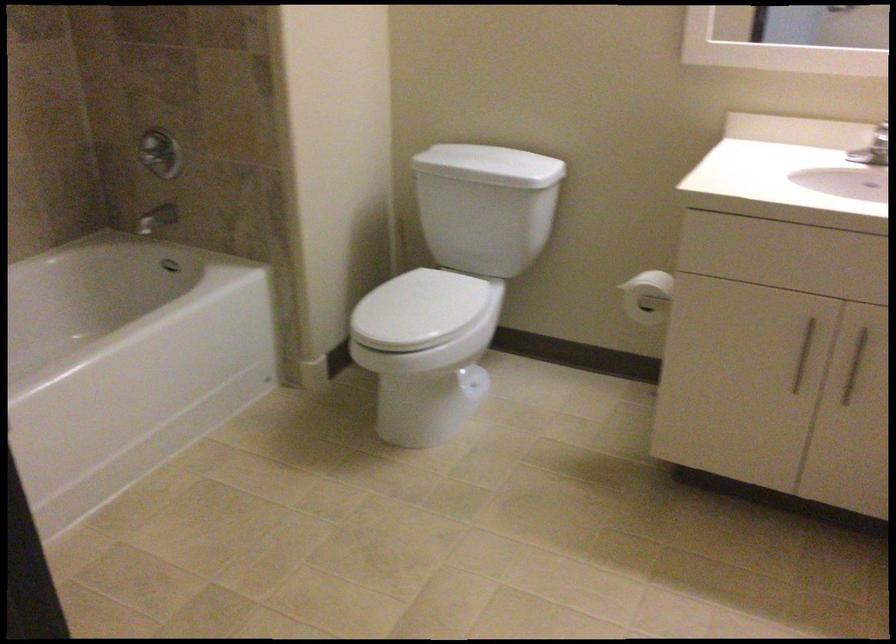
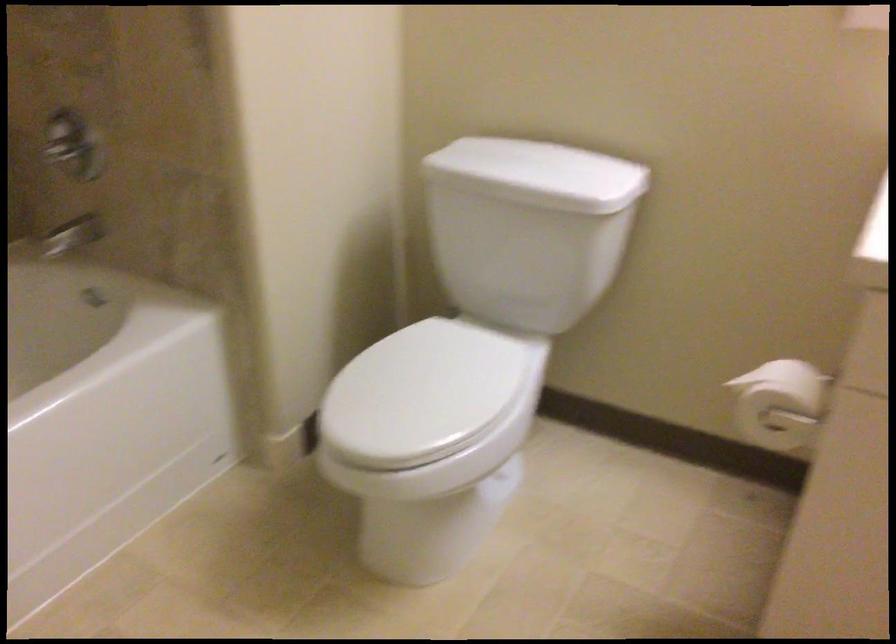
Question: Based on the continuous images, in which direction is the camera rotating? Reply with the corresponding letter.

Choices:
 (A) Left
 (B) Right
 (C) Up
 (D) Down

Answer: (D)